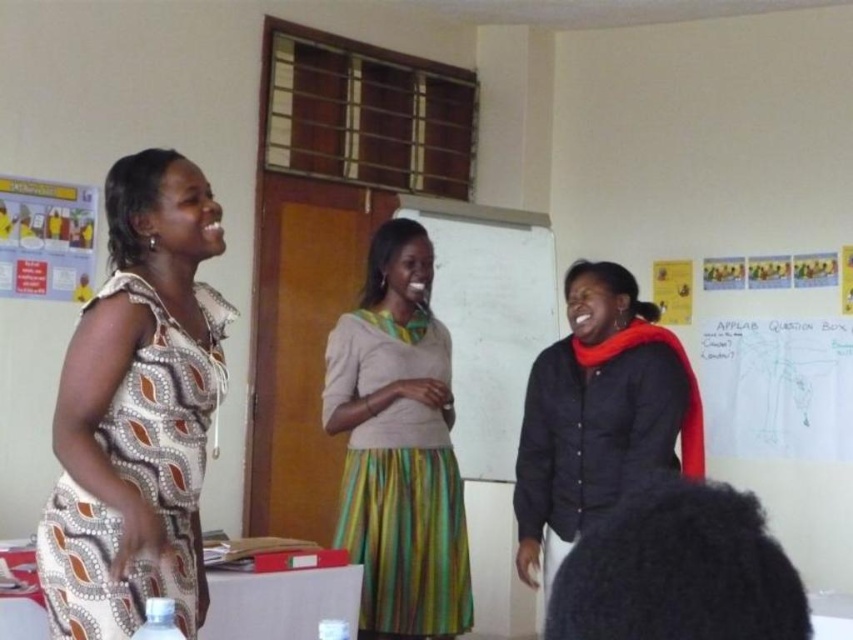
Which is more to the right, printed fabric dress at left or green striped skirt at center?

From the viewer's perspective, green striped skirt at center appears more on the right side.

Locate an element on the screen. printed fabric dress at left is located at coordinates [x=137, y=410].

Who is more forward, (57, 592) or (346, 509)?

Positioned in front is point (57, 592).

Identify the location of printed fabric dress at left. The height and width of the screenshot is (640, 853). (137, 410).

Who is higher up, printed fabric dress at left or whiteboard at center?

whiteboard at center is higher up.

Can you confirm if printed fabric dress at left is wider than whiteboard at center?

No, printed fabric dress at left is not wider than whiteboard at center.

Who is more forward, (x=119, y=593) or (x=521, y=320)?

Point (x=119, y=593)

Where is `printed fabric dress at left`? The image size is (853, 640). printed fabric dress at left is located at coordinates (137, 410).

Does green striped skirt at center have a larger size compared to whiteboard at center?

No, green striped skirt at center is not bigger than whiteboard at center.

Can you confirm if green striped skirt at center is thinner than whiteboard at center?

Yes.

Does point (395, 477) lie behind point (428, 209)?

No, it is in front of (428, 209).

I want to click on green striped skirt at center, so click(x=398, y=445).